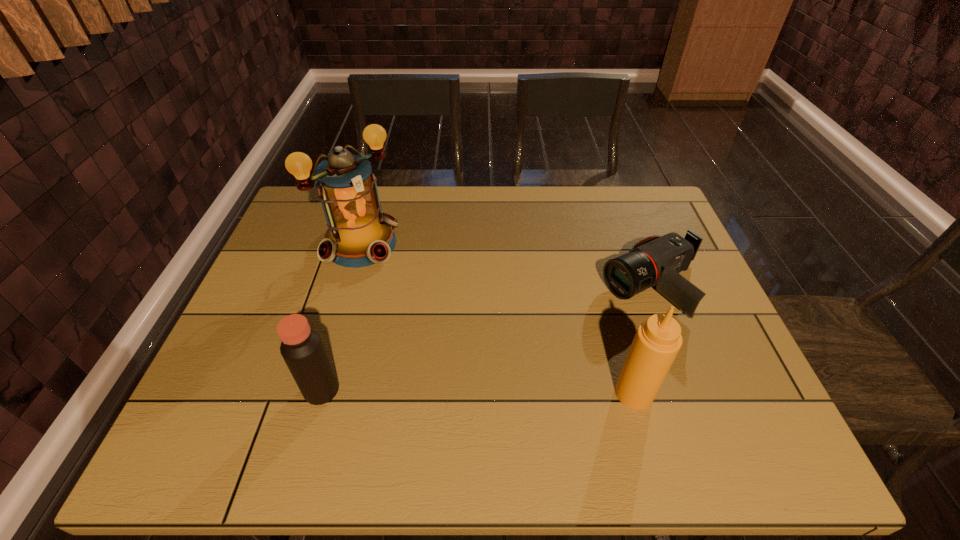
You are a GUI agent. You are given a task and a screenshot of the screen. Output one action in this format:
    pyautogui.click(x=<x>, y=<y>)
    Task: Click on the vinegar
    
    Given the screenshot: What is the action you would take?
    pyautogui.click(x=302, y=349)

Where is `condiment`? The width and height of the screenshot is (960, 540). condiment is located at coordinates (658, 339).

Identify the location of the tallest object. (359, 234).

I want to click on camcorder, so click(x=655, y=260).

Where is `free space located 0.100m on the left of the vinegar`? This screenshot has height=540, width=960. free space located 0.100m on the left of the vinegar is located at coordinates (258, 390).

The width and height of the screenshot is (960, 540). I want to click on vacant space located 0.290m on the left of the condiment, so click(x=482, y=393).

What are the coordinates of `free space located 0.290m on the front-facing side of the tallest object` in the screenshot? It's located at (446, 321).

Where is `vacant point located 0.360m on the front-facing side of the tallest object`? The image size is (960, 540). vacant point located 0.360m on the front-facing side of the tallest object is located at coordinates 465,338.

At what (x,y) coordinates should I click in order to perform the action: click on vacant space located 0.340m on the front-facing side of the tallest object. Please return your answer as a coordinate pair (x, y). This screenshot has width=960, height=540. Looking at the image, I should click on (459, 333).

The width and height of the screenshot is (960, 540). Find the location of `vacant space located on the lens of the camcorder`. vacant space located on the lens of the camcorder is located at coordinates (539, 339).